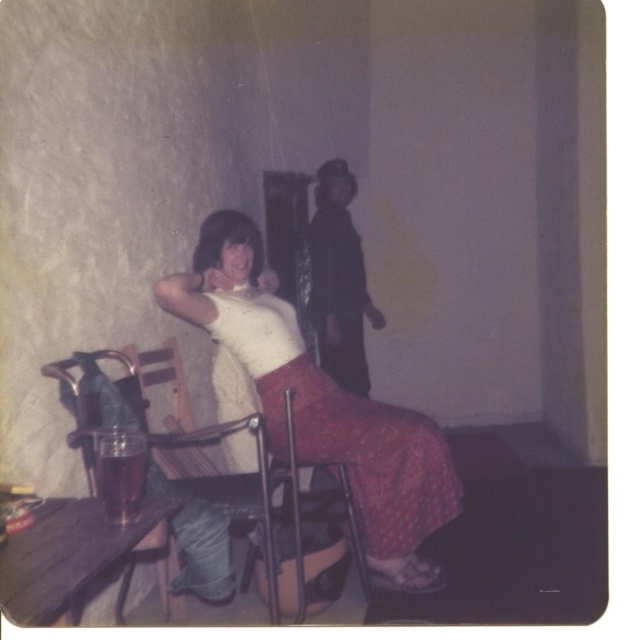
You are a fashion designer observing the image. You need to determine which item of clothing is shorter in height between the white matte tank top at center and the dark gray fabric jacket at center. Which one is shorter?

The white matte tank top at center has a lesser height compared to the dark gray fabric jacket at center, so the white matte tank top at center is shorter in height.

You are trying to place a small decorative item on the wooden table at lower left, but you notice the dark gray fabric jacket at center might block the view. Will the jacket obscure the table from someone standing in front of it?

The wooden table at lower left has a lesser height compared to dark gray fabric jacket at center, so the jacket will likely block the view of the table from the front.

You are a guest at a party and you see the wooden table at lower left and the dark gray fabric jacket at center. Which object is closer to the floor?

The wooden table at lower left is closer to the floor because it is positioned below the dark gray fabric jacket at center.